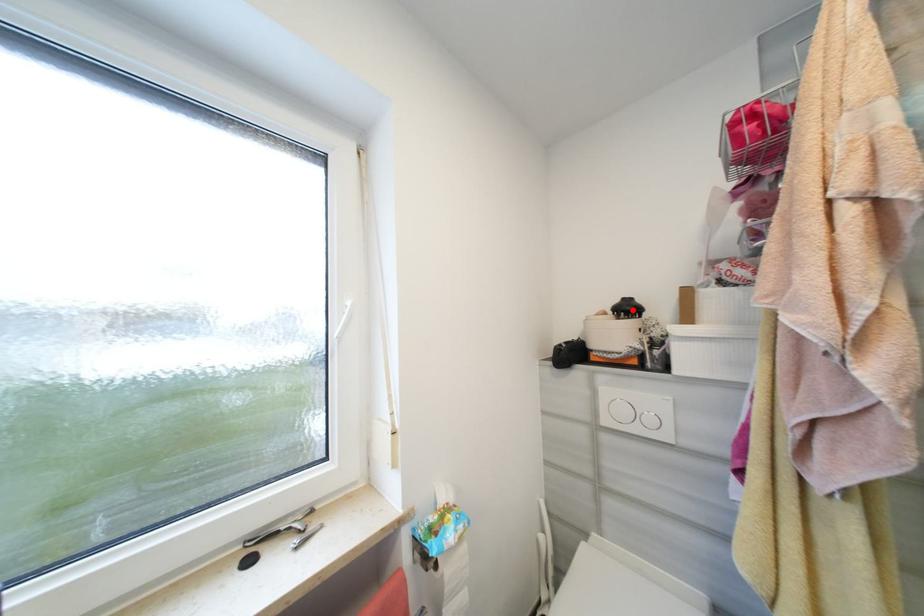
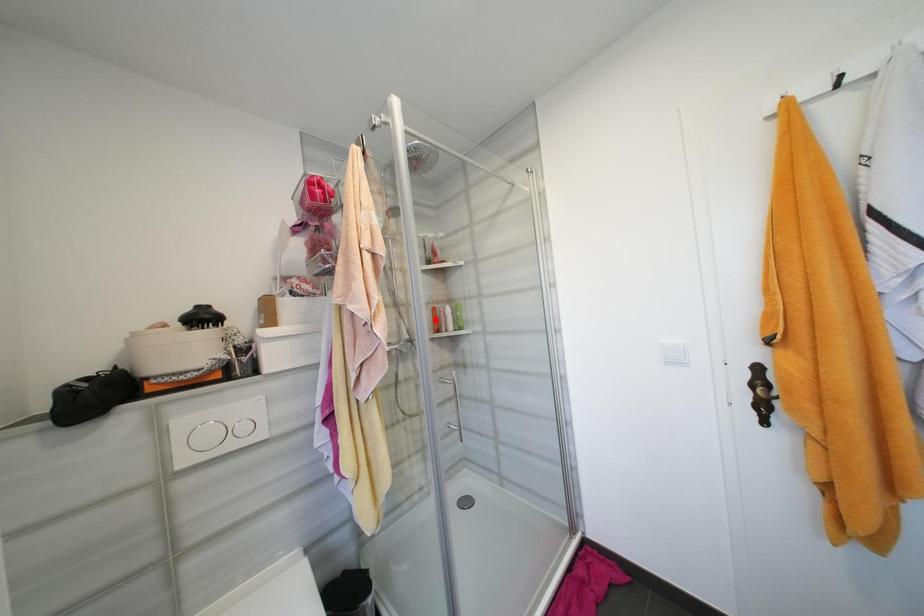
I am providing you with two images of the same scene from different viewpoints. A red point is marked on the first image and another point is marked on the second image. Are the points marked in image1 and image2 representing the same 3D position?

No